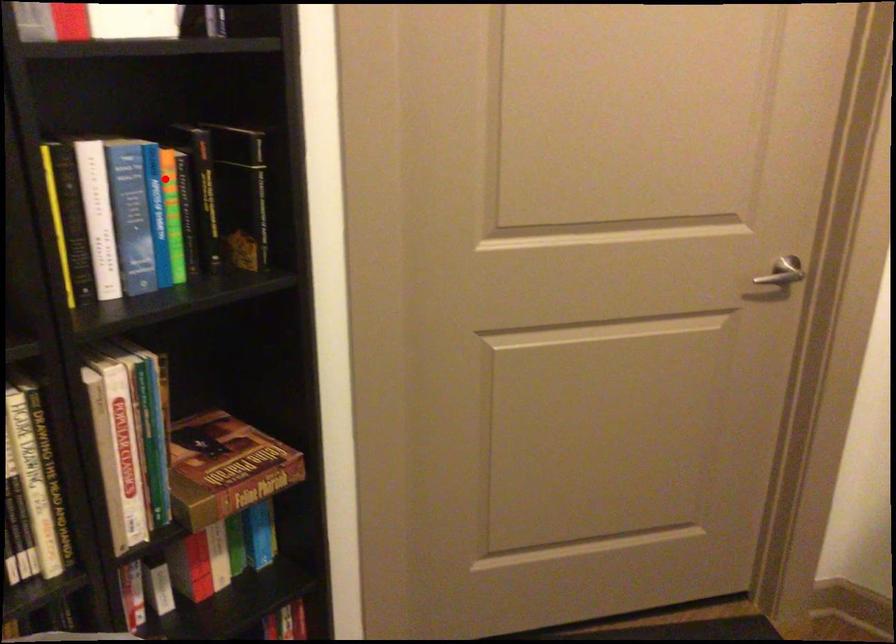
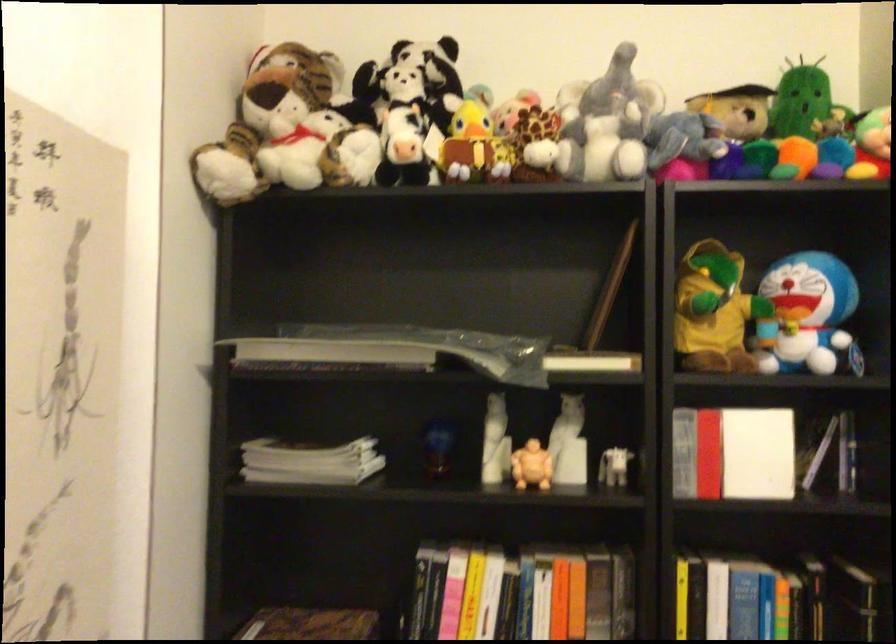
Question: I am providing you with two images of the same scene from different viewpoints. In image1, a red point is highlighted. Considering the same 3D point in image2, which of the following is correct?

Choices:
 (A) It is closer
 (B) It is farther

Answer: (B)